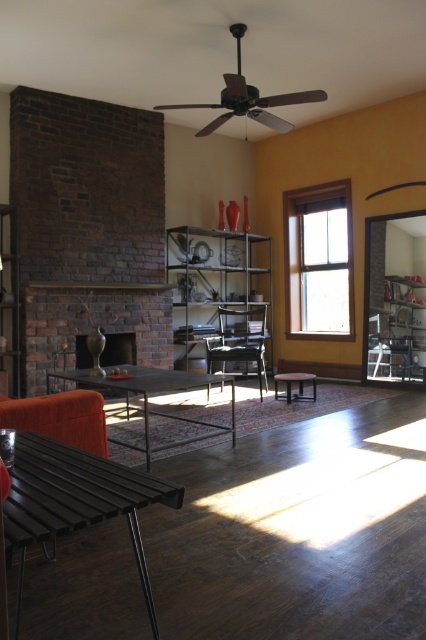
Does black metal bench at lower left have a lesser width compared to clear glass window at center?

Yes.

Locate an element on the screen. This screenshot has height=640, width=426. black metal bench at lower left is located at coordinates (75, 500).

Does point (250, 323) come behind point (374, 339)?

Yes, point (250, 323) is farther from viewer.

Does metallic black armchair at center have a lesser height compared to metallic silver chair at right?

No.

Is point (239, 314) positioned behind point (388, 346)?

Yes.

Find the location of `metallic black armchair at center`. metallic black armchair at center is located at coordinates (239, 340).

Which of these two, black metal bench at lower left or wooden stool at center, stands shorter?

wooden stool at center

Locate an element on the screen. The height and width of the screenshot is (640, 426). black metal bench at lower left is located at coordinates (75, 500).

Locate an element on the screen. black metal bench at lower left is located at coordinates (75, 500).